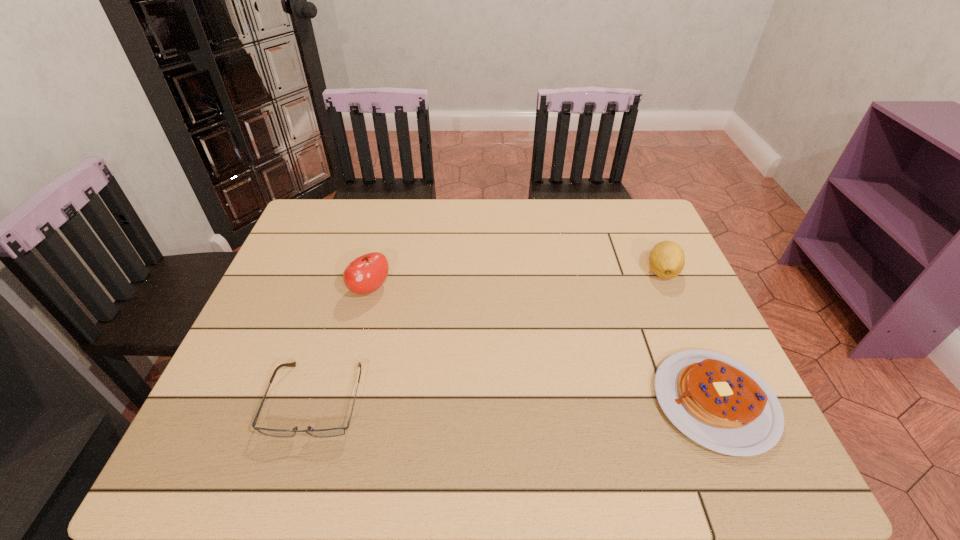
You are a GUI agent. You are given a task and a screenshot of the screen. Output one action in this format:
    pyautogui.click(x=<x>, y=<y>)
    Task: Click on the free spot on the desktop that is between the spectacles and the pancake and is positioned on the stem of the tallest object
    Image resolution: width=960 pixels, height=540 pixels.
    Given the screenshot: What is the action you would take?
    pyautogui.click(x=462, y=400)

Where is `free space on the desktop that is between the shortest object and the pancake and is positioned at the stem end of the third shortest object`? This screenshot has width=960, height=540. free space on the desktop that is between the shortest object and the pancake and is positioned at the stem end of the third shortest object is located at coordinates (564, 401).